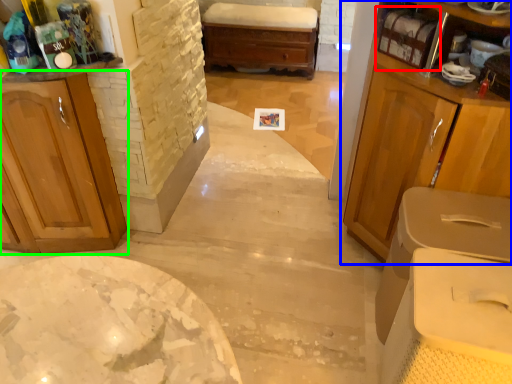
Question: Which object is the closest to the shelf (highlighted by a red box)? Choose among these: cabinetry (highlighted by a blue box) or cabinetry (highlighted by a green box).

Choices:
 (A) cabinetry
 (B) cabinetry

Answer: (A)